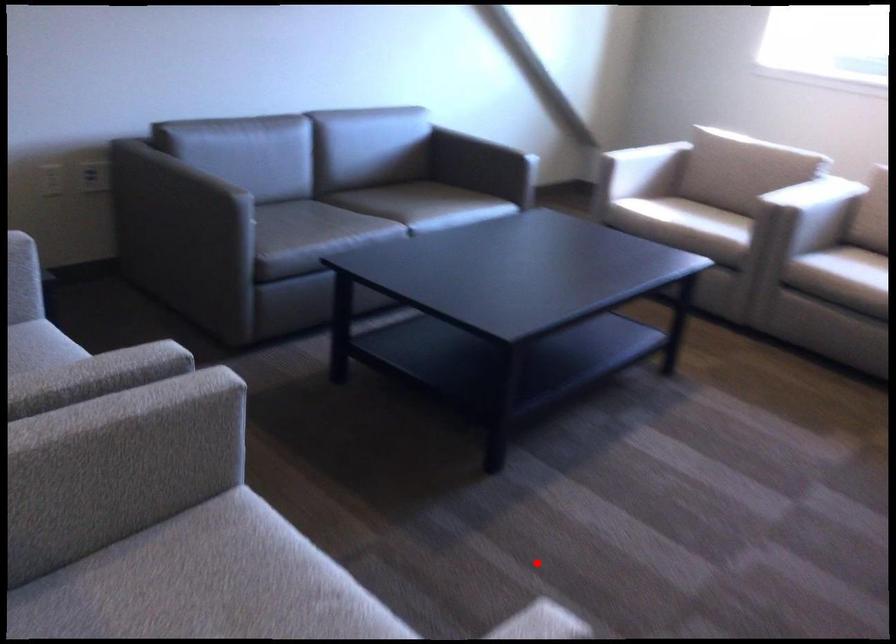
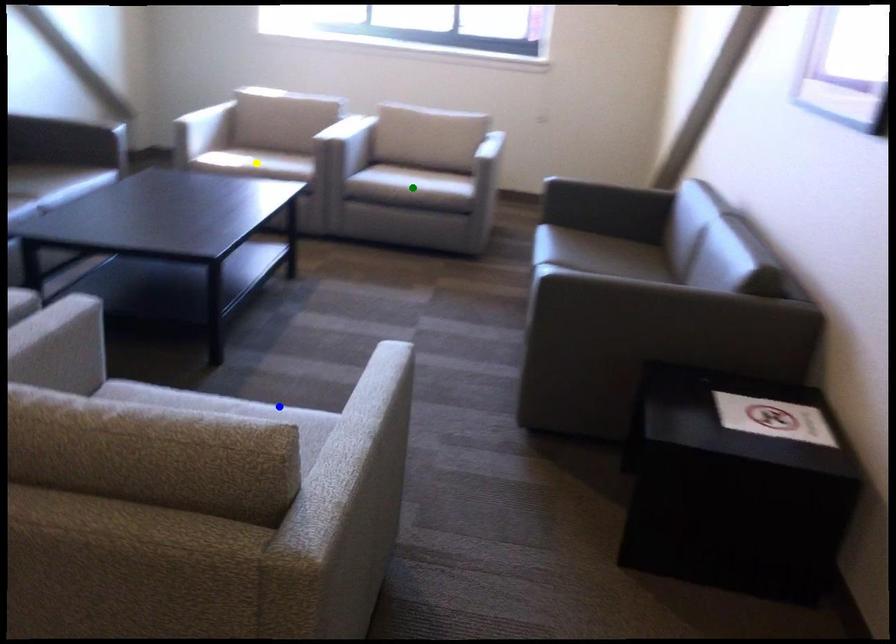
Question: I am providing you with two images of the same scene from different viewpoints. A red point is marked on the first image. You are given multiple points on the second image. Can you choose the point in image 2 that corresponds to the point in image 1?

Choices:
 (A) green point
 (B) blue point
 (C) yellow point

Answer: (B)